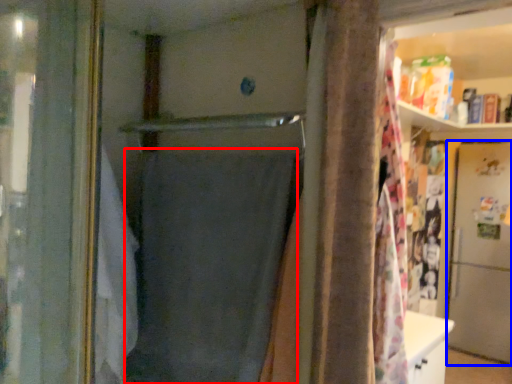
Question: Which point is closer to the camera, shower curtain (highlighted by a red box) or screen door (highlighted by a blue box)?

Choices:
 (A) shower curtain
 (B) screen door

Answer: (A)